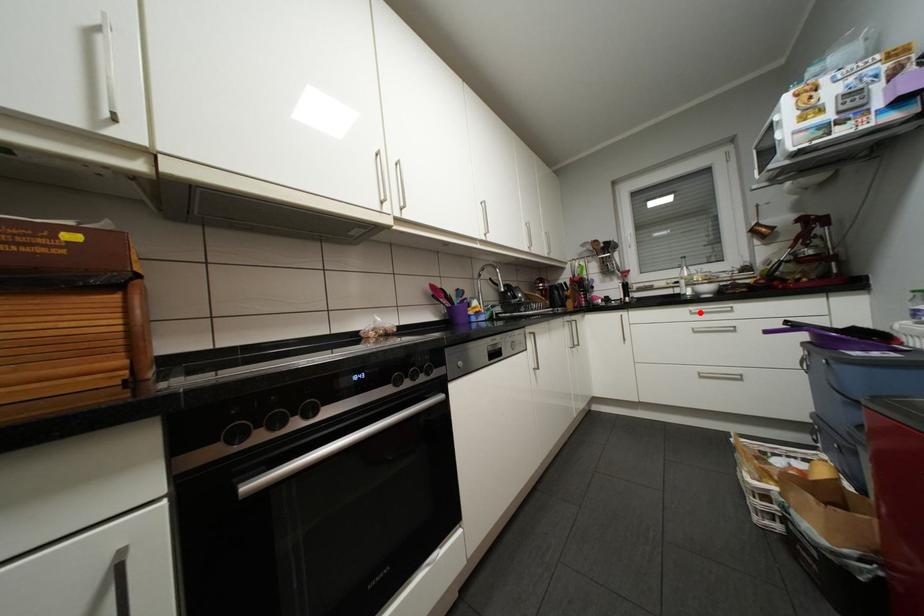
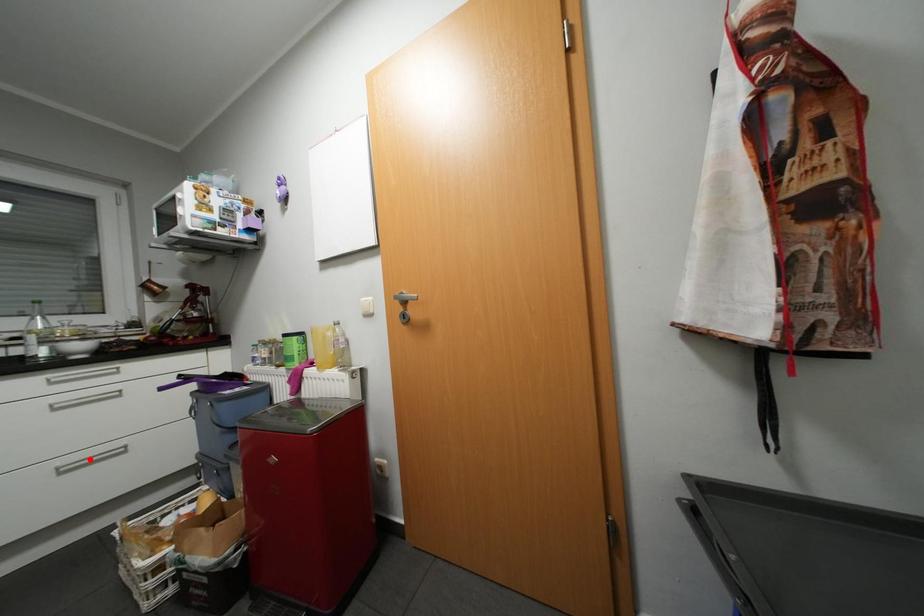
I am providing you with two images of the same scene from different viewpoints. A red point is marked on the first image and another point is marked on the second image. Do the highlighted points in image1 and image2 indicate the same real-world spot?

No